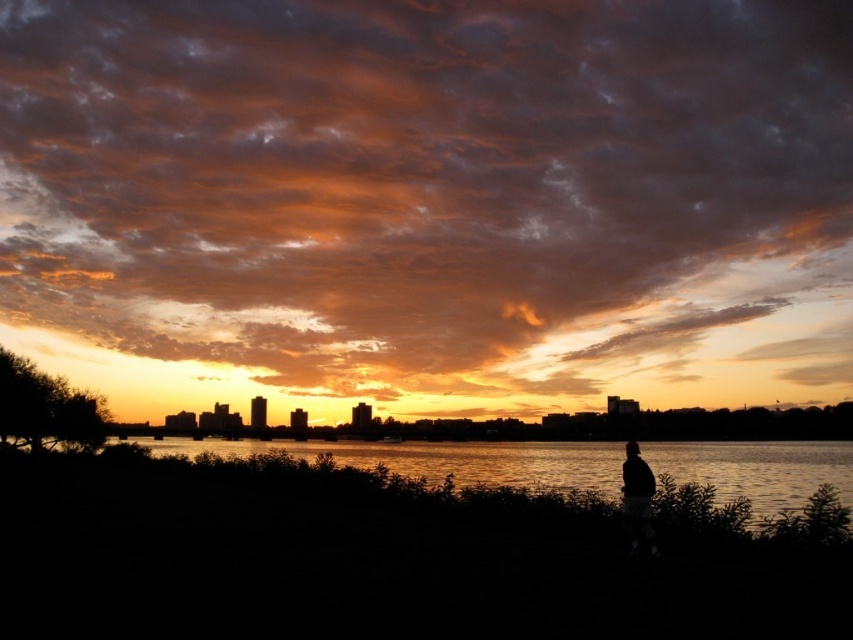
You are a photographer trying to capture the sunset. You notice the orange matte cloud at upper center and the black matte person at right in your frame. Based on their sizes in the image, which object would you say is farther from the camera?

The orange matte cloud at upper center is farther from the camera because it has a larger width than the black matte person at right, indicating it is either larger in actual size or positioned further away to appear bigger in the frame.

You are a photographer trying to capture the sunset scene. You notice the orange matte cloud at upper center and the black matte person at right. Which object in the scene is bigger?

The orange matte cloud at upper center is larger than the black matte person at right.